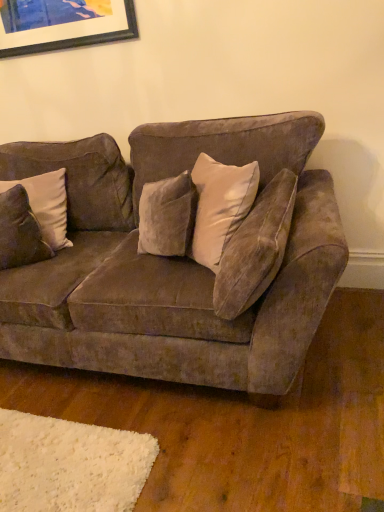
The image size is (384, 512). I want to click on matte black picture frame at upper left, so click(63, 24).

The width and height of the screenshot is (384, 512). I want to click on velvet brown pillow at left, so click(47, 205).

In terms of height, does velvet brown pillow at left look taller or shorter compared to velvet brown couch at center?

velvet brown pillow at left is shorter than velvet brown couch at center.

Would you consider velvet brown pillow at left to be distant from velvet brown couch at center?

They are positioned close to each other.

Is velvet brown pillow at left at the left side of velvet brown couch at center?

Yes.

Consider the image. Which object is positioned more to the left, velvet brown couch at center or matte black picture frame at upper left?

Positioned to the left is matte black picture frame at upper left.

Can we say velvet brown couch at center lies outside matte black picture frame at upper left?

Absolutely, velvet brown couch at center is external to matte black picture frame at upper left.

In terms of size, does velvet brown couch at center appear bigger or smaller than matte black picture frame at upper left?

Clearly, velvet brown couch at center is larger in size than matte black picture frame at upper left.

From a real-world perspective, is matte black picture frame at upper left located beneath velvet brown pillow at left?

Incorrect, from a real-world perspective, matte black picture frame at upper left is higher than velvet brown pillow at left.

Considering the sizes of objects matte black picture frame at upper left and velvet brown pillow at left in the image provided, who is thinner, matte black picture frame at upper left or velvet brown pillow at left?

matte black picture frame at upper left is thinner.

Is matte black picture frame at upper left facing towards velvet brown pillow at left?

No, matte black picture frame at upper left does not turn towards velvet brown pillow at left.

Looking at this image, how different are the orientations of matte black picture frame at upper left and velvet brown pillow at left in degrees?

18.9 degrees.

In the image, is velvet brown pillow at left on the left side or the right side of matte black picture frame at upper left?

velvet brown pillow at left is to the left of matte black picture frame at upper left.

In terms of size, does velvet brown pillow at left appear bigger or smaller than matte black picture frame at upper left?

In the image, velvet brown pillow at left appears to be larger than matte black picture frame at upper left.

Consider the image. From the image's perspective, is velvet brown pillow at left over matte black picture frame at upper left?

No.

Is point (64, 182) more distant than point (90, 7)?

That is True.

From the picture: From their relative heights in the image, would you say matte black picture frame at upper left is taller or shorter than velvet brown couch at center?

matte black picture frame at upper left is shorter than velvet brown couch at center.

What's the angular difference between matte black picture frame at upper left and velvet brown couch at center's facing directions?

They differ by 0.000558 degrees in their facing directions.

Relative to velvet brown couch at center, is matte black picture frame at upper left in front or behind?

matte black picture frame at upper left is positioned farther from the viewer than velvet brown couch at center.

Which is nearer, [28,41] or [137,284]?

Point [28,41] is positioned farther from the camera compared to point [137,284].

From a real-world perspective, is velvet brown couch at center positioned under velvet brown pillow at left based on gravity?

Correct, in the physical world, velvet brown couch at center is lower than velvet brown pillow at left.

Is velvet brown pillow at left at the back of velvet brown couch at center?

Yes, velvet brown couch at center is facing away from velvet brown pillow at left.

Do you think velvet brown couch at center is within velvet brown pillow at left, or outside of it?

velvet brown couch at center is not inside velvet brown pillow at left, it's outside.

Identify the location of pillow above the velvet brown couch at center (from the image's perspective). (47, 205).

In order to click on studio couch on the right of matte black picture frame at upper left in this screenshot , I will do `click(171, 262)`.

In the scene shown: Based on their spatial positions, is matte black picture frame at upper left or velvet brown pillow at left closer to velvet brown couch at center?

velvet brown pillow at left lies closer to velvet brown couch at center than the other object.

From the image, which object appears to be farther from matte black picture frame at upper left, velvet brown couch at center or velvet brown pillow at left?

The object further to matte black picture frame at upper left is velvet brown couch at center.

Based on their spatial positions, is velvet brown pillow at left or velvet brown couch at center further from matte black picture frame at upper left?

Based on the image, velvet brown couch at center appears to be further to matte black picture frame at upper left.

From the image, which object appears to be nearer to velvet brown pillow at left, matte black picture frame at upper left or velvet brown couch at center?

velvet brown couch at center is positioned closer to the anchor velvet brown pillow at left.

Based on their spatial positions, is velvet brown couch at center or matte black picture frame at upper left closer to velvet brown pillow at left?

Among the two, velvet brown couch at center is located nearer to velvet brown pillow at left.

When comparing their distances from velvet brown couch at center, does velvet brown pillow at left or matte black picture frame at upper left seem further?

matte black picture frame at upper left lies further to velvet brown couch at center than the other object.

This screenshot has width=384, height=512. I want to click on pillow between matte black picture frame at upper left and velvet brown couch at center from top to bottom, so click(47, 205).